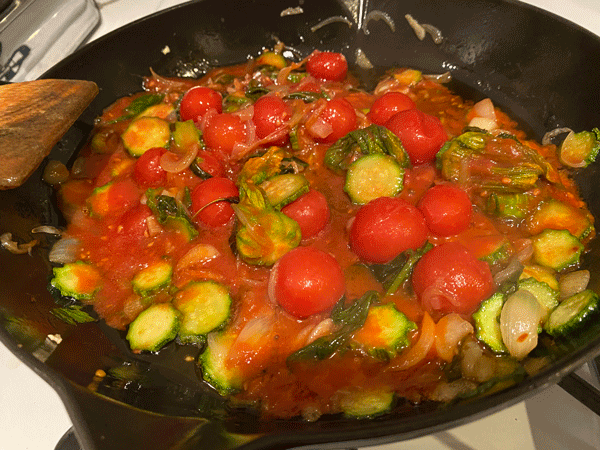
Find the location of a particular element. countertop is located at coordinates (126, 9), (585, 21).